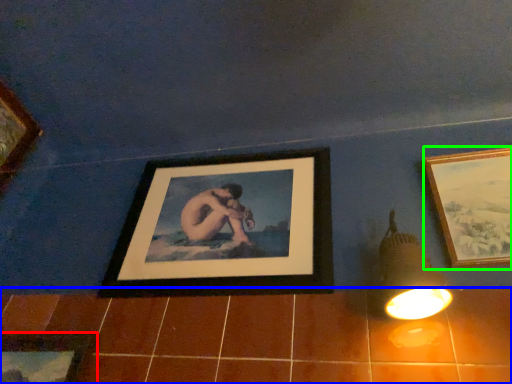
Question: Which object is positioned closest to picture frame (highlighted by a red box)? Select from ceramic tile (highlighted by a blue box) and picture frame (highlighted by a green box).

Choices:
 (A) ceramic tile
 (B) picture frame

Answer: (A)